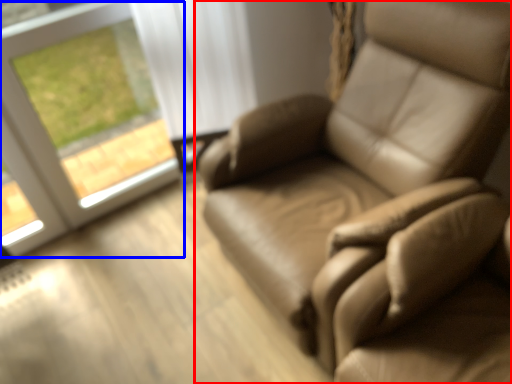
Question: Which of the following is the farthest to the observer, chair (highlighted by a red box) or window (highlighted by a blue box)?

Choices:
 (A) chair
 (B) window

Answer: (B)